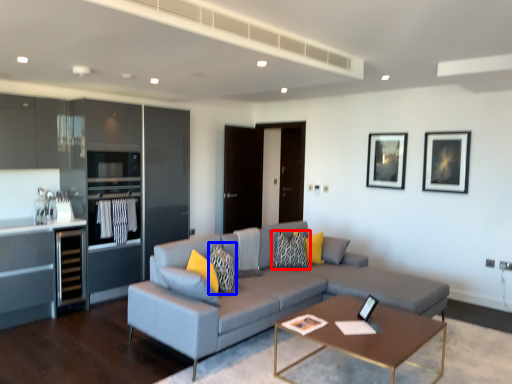
Question: Which object appears closest to the camera in this image, pillow (highlighted by a red box) or pillow (highlighted by a blue box)?

Choices:
 (A) pillow
 (B) pillow

Answer: (B)